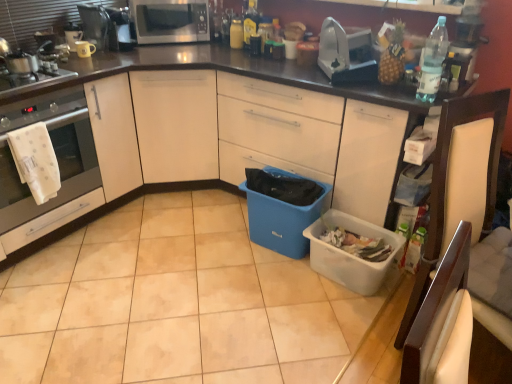
The height and width of the screenshot is (384, 512). I want to click on vacant area on top of beige tile at center (from a real-world perspective), so click(186, 294).